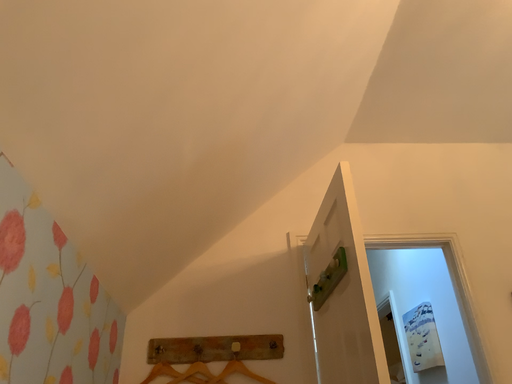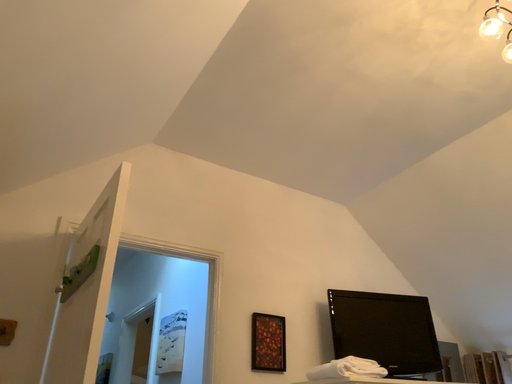
Question: Which way did the camera rotate in the video?

Choices:
 (A) rotated left
 (B) rotated right

Answer: (B)